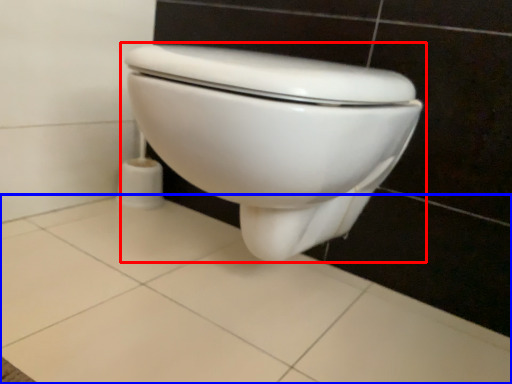
Question: Which point is further to the camera, toilet (highlighted by a red box) or ceramic tile (highlighted by a blue box)?

Choices:
 (A) toilet
 (B) ceramic tile

Answer: (A)